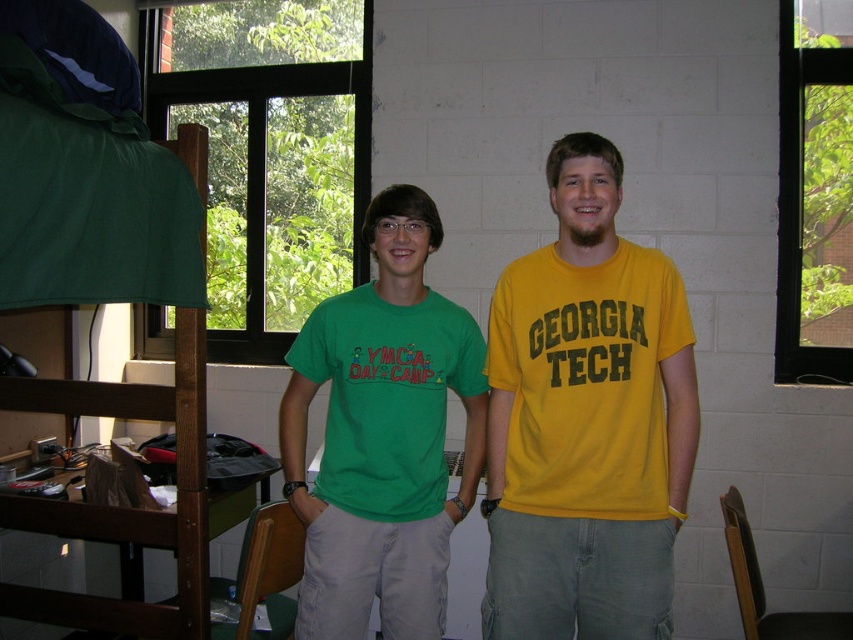
Question: Which point appears closest to the camera in this image?

Choices:
 (A) (645, 252)
 (B) (74, 180)
 (C) (402, 188)

Answer: (B)

Question: Which of these objects is positioned closest to the green matte t-shirt at center?

Choices:
 (A) green fabric bunk bed at left
 (B) yellow cotton t-shirt at center

Answer: (B)

Question: Is yellow cotton t-shirt at center positioned at the back of green matte t-shirt at center?

Choices:
 (A) no
 (B) yes

Answer: (A)

Question: Considering the real-world distances, which object is farthest from the green matte t-shirt at center?

Choices:
 (A) yellow cotton t-shirt at center
 (B) green fabric bunk bed at left

Answer: (B)

Question: Is yellow cotton t-shirt at center positioned behind green fabric bunk bed at left?

Choices:
 (A) no
 (B) yes

Answer: (B)

Question: From the image, what is the correct spatial relationship of green matte t-shirt at center in relation to green fabric bunk bed at left?

Choices:
 (A) below
 (B) above

Answer: (A)